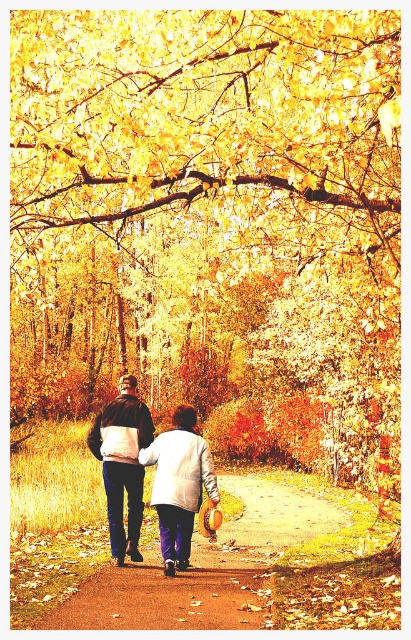
You are standing behind the two people in the scene and want to walk towards the brown dirt path at center. Which direction should you move relative to the dark brown leather jacket at center?

The brown dirt path at center is positioned on the right side of dark brown leather jacket at center, so you should move to the right of the dark brown leather jacket at center to reach the path.